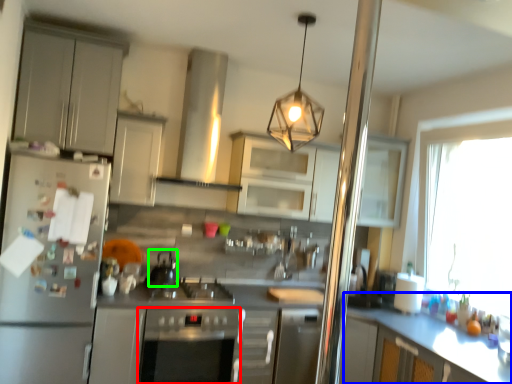
Question: Estimate the real-world distances between objects in this image. Which object is farther from oven (highlighted by a red box), counter (highlighted by a blue box) or appliance (highlighted by a green box)?

Choices:
 (A) counter
 (B) appliance

Answer: (A)